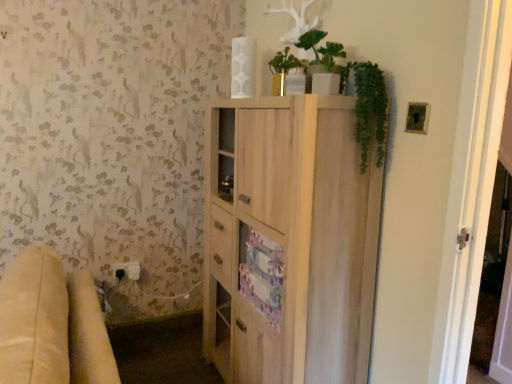
Question: From a real-world perspective, is light wood cabinet at center beneath white plastic electric outlet at lower left?

Choices:
 (A) no
 (B) yes

Answer: (A)

Question: Can you confirm if light wood cabinet at center is smaller than white plastic electric outlet at lower left?

Choices:
 (A) yes
 (B) no

Answer: (B)

Question: Is the depth of light wood cabinet at center less than that of white plastic electric outlet at lower left?

Choices:
 (A) no
 (B) yes

Answer: (B)

Question: Does light wood cabinet at center come behind white plastic electric outlet at lower left?

Choices:
 (A) yes
 (B) no

Answer: (B)

Question: Can you confirm if light wood cabinet at center is taller than white plastic electric outlet at lower left?

Choices:
 (A) no
 (B) yes

Answer: (B)

Question: From a real-world perspective, is light wood cabinet at center on top of white plastic electric outlet at lower left?

Choices:
 (A) no
 (B) yes

Answer: (B)

Question: Is green leafy plant at upper right positioned behind beige fabric couch at lower left?

Choices:
 (A) yes
 (B) no

Answer: (A)

Question: Is green leafy plant at upper right outside of beige fabric couch at lower left?

Choices:
 (A) no
 (B) yes

Answer: (B)

Question: Would you say beige fabric couch at lower left is part of green leafy plant at upper right's contents?

Choices:
 (A) yes
 (B) no

Answer: (B)

Question: From a real-world perspective, is green leafy plant at upper right below beige fabric couch at lower left?

Choices:
 (A) no
 (B) yes

Answer: (A)

Question: Is green leafy plant at upper right shorter than beige fabric couch at lower left?

Choices:
 (A) no
 (B) yes

Answer: (B)

Question: Is green leafy plant at upper right not close to beige fabric couch at lower left?

Choices:
 (A) no
 (B) yes

Answer: (B)

Question: Does green matte plant at upper center appear on the left side of beige fabric couch at lower left?

Choices:
 (A) no
 (B) yes

Answer: (A)